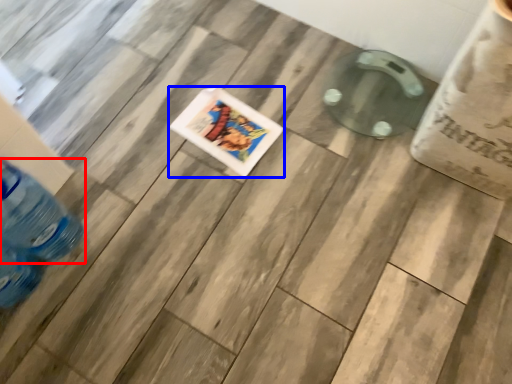
Question: Which of the following is the closest to the observer, bottle (highlighted by a red box) or comic book (highlighted by a blue box)?

Choices:
 (A) bottle
 (B) comic book

Answer: (A)